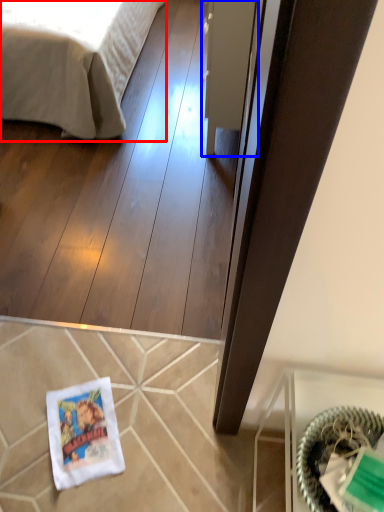
Question: Which of the following is the farthest to the observer, bed (highlighted by a red box) or glass door (highlighted by a blue box)?

Choices:
 (A) bed
 (B) glass door

Answer: (A)